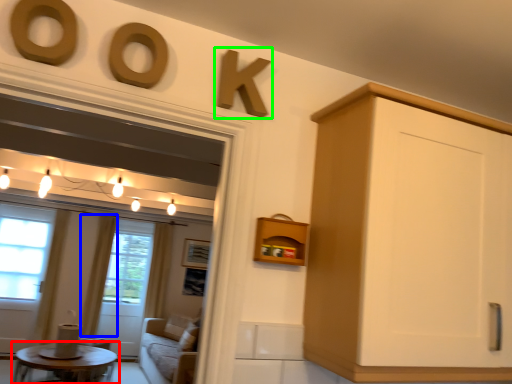
Question: Based on their relative distances, which object is farther from coffee table (highlighted by a red box)? Choose from curtain (highlighted by a blue box) and number (highlighted by a green box).

Choices:
 (A) curtain
 (B) number

Answer: (B)